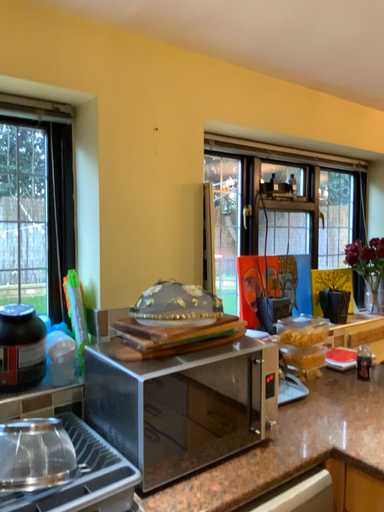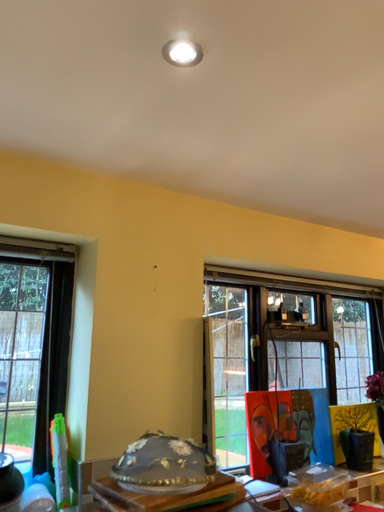
Question: Which way did the camera rotate in the video?

Choices:
 (A) rotated downward
 (B) rotated upward

Answer: (B)